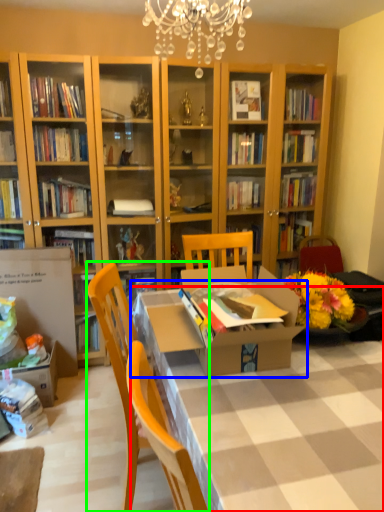
Question: Estimate the real-world distances between objects in this image. Which object is farther from desk (highlighted by a red box), table (highlighted by a blue box) or chair (highlighted by a green box)?

Choices:
 (A) table
 (B) chair

Answer: (B)